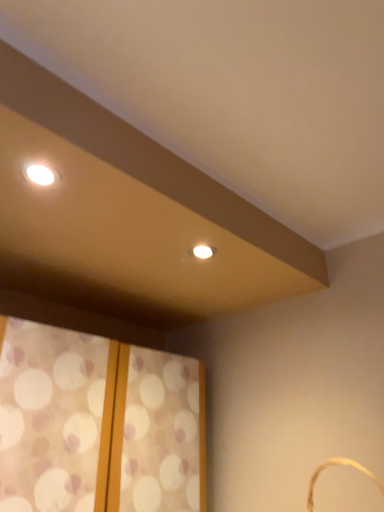
Question: From the image's perspective, is patterned fabric window at lower left located above or below gold woven basket at lower right?

Choices:
 (A) below
 (B) above

Answer: (A)

Question: Is patterned fabric window at lower left in front of or behind gold woven basket at lower right in the image?

Choices:
 (A) behind
 (B) front

Answer: (A)

Question: From their relative heights in the image, would you say patterned fabric window at lower left is taller or shorter than gold woven basket at lower right?

Choices:
 (A) short
 (B) tall

Answer: (B)

Question: Would you say gold woven basket at lower right is to the left or to the right of patterned fabric window at lower left in the picture?

Choices:
 (A) left
 (B) right

Answer: (B)

Question: In terms of height, does gold woven basket at lower right look taller or shorter compared to patterned fabric window at lower left?

Choices:
 (A) tall
 (B) short

Answer: (B)

Question: From the image's perspective, relative to patterned fabric window at lower left, is gold woven basket at lower right above or below?

Choices:
 (A) below
 (B) above

Answer: (B)

Question: In terms of width, does gold woven basket at lower right look wider or thinner when compared to patterned fabric window at lower left?

Choices:
 (A) thin
 (B) wide

Answer: (A)